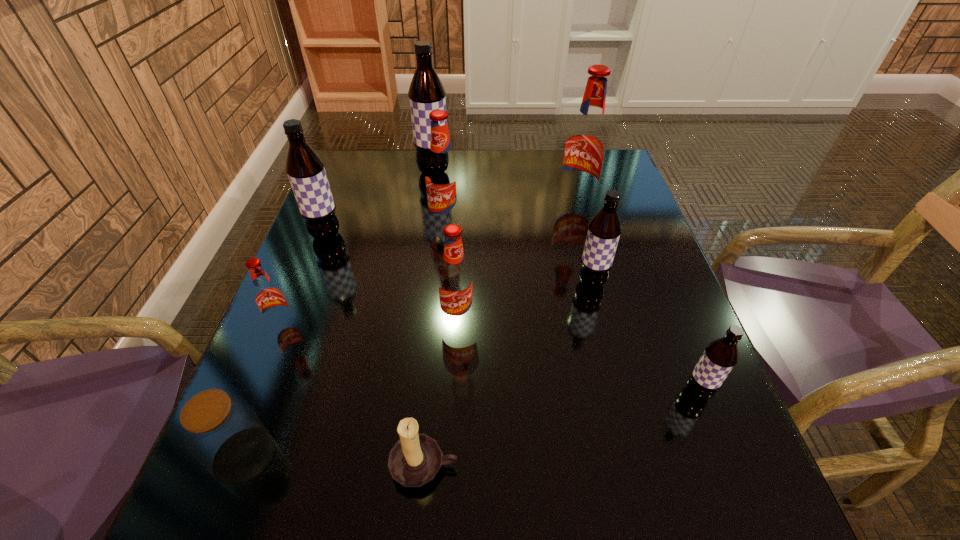
Image resolution: width=960 pixels, height=540 pixels. In order to click on vacant space located on the front of the second smallest red root beer in this screenshot , I will do `click(455, 360)`.

Where is `free spot located 0.300m on the right of the smallest red root beer`? The height and width of the screenshot is (540, 960). free spot located 0.300m on the right of the smallest red root beer is located at coordinates (442, 326).

Locate an element on the screen. This screenshot has width=960, height=540. vacant point located on the left of the rightmost root beer is located at coordinates (650, 393).

The image size is (960, 540). In order to click on vacant space located 0.320m on the back of the brown jar in this screenshot , I will do `click(307, 291)`.

At what (x,y) coordinates should I click in order to perform the action: click on vacant space located 0.060m on the wick of the candle holder. Please return your answer as a coordinate pair (x, y). This screenshot has width=960, height=540. Looking at the image, I should click on (418, 537).

The height and width of the screenshot is (540, 960). I want to click on object present at the far edge, so click(426, 93).

Where is `jar that is at the near edge`? jar that is at the near edge is located at coordinates (220, 430).

Locate an element on the screen. This screenshot has width=960, height=540. candle holder that is positioned at the near edge is located at coordinates (415, 459).

At what (x,y) coordinates should I click in order to perform the action: click on jar located in the left edge section of the desktop. Please return your answer as a coordinate pair (x, y). This screenshot has width=960, height=540. Looking at the image, I should click on (220, 430).

Identify the location of object at the near left corner. (220, 430).